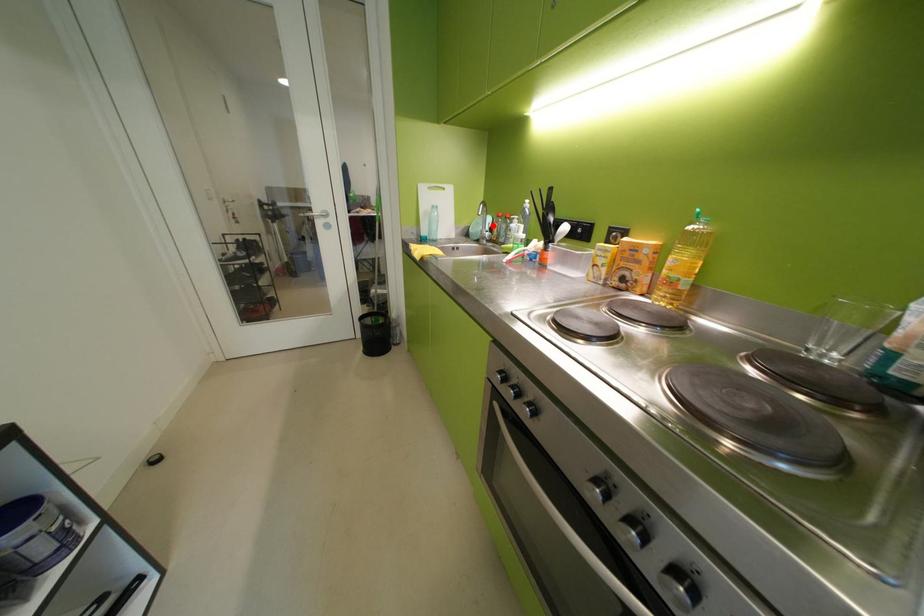
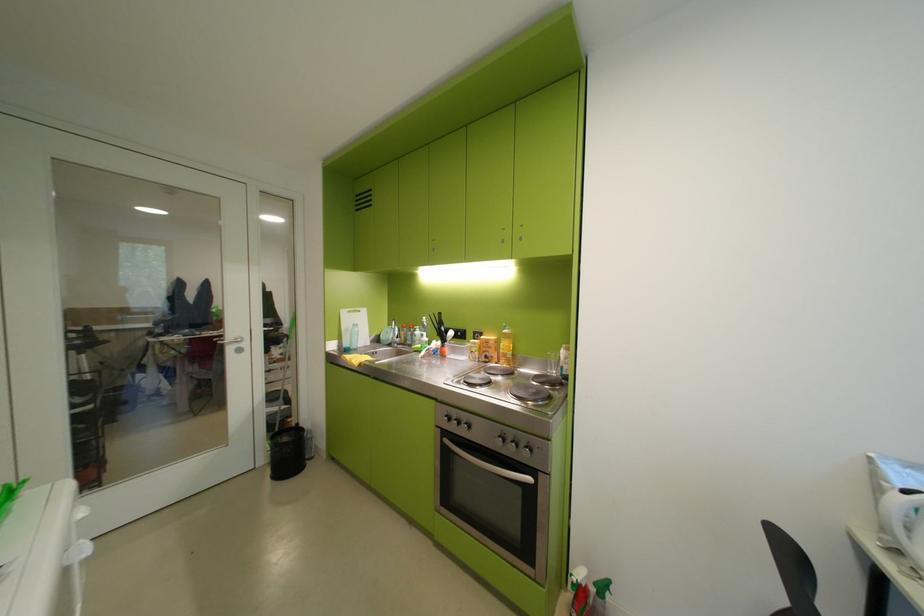
The point at the highlighted location is marked in the first image. Where is the corresponding point in the second image?

(400, 334)